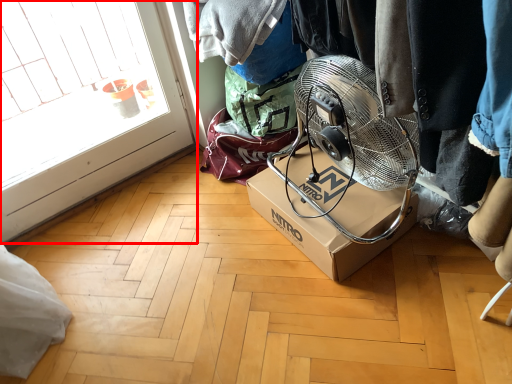
Question: From the image's perspective, where is glass door (annotated by the red box) located in relation to box in the image?

Choices:
 (A) below
 (B) above

Answer: (B)